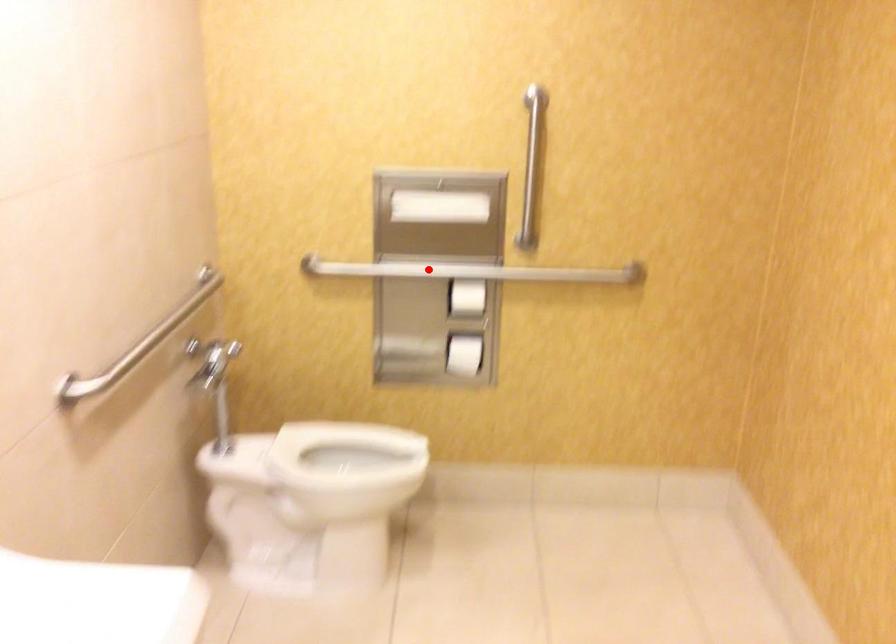
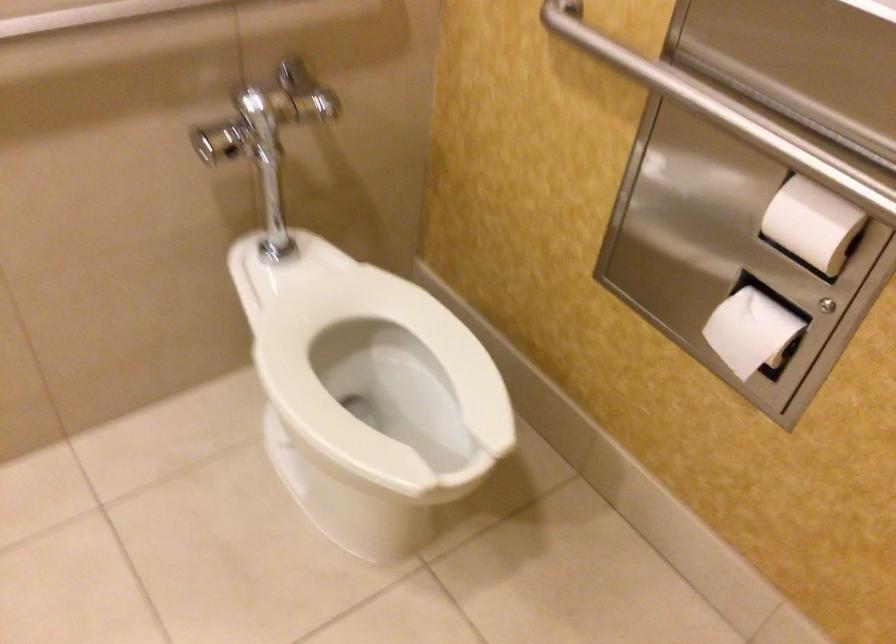
The point at the highlighted location is marked in the first image. Where is the corresponding point in the second image?

(725, 111)